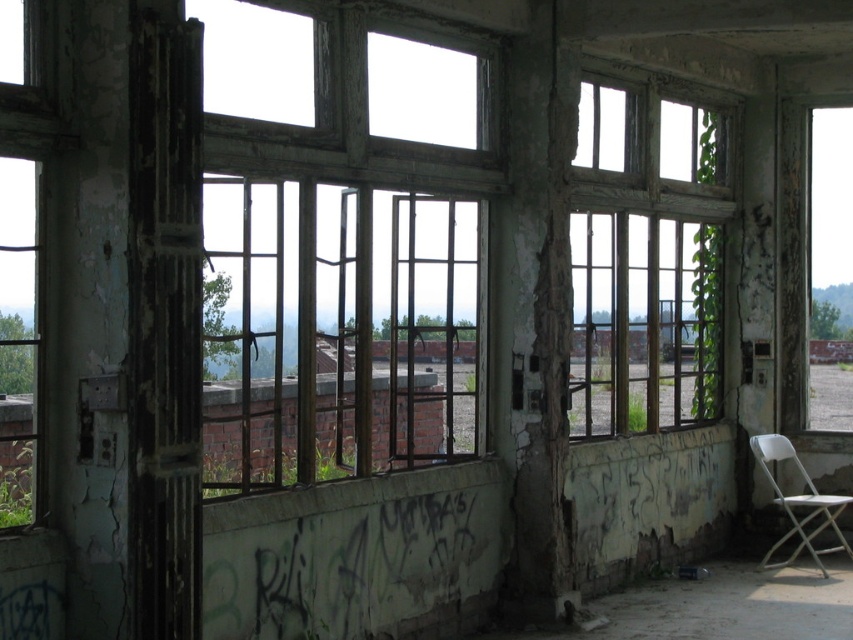
You are a maintenance worker needing to reach the wooden window at center from the white plastic folding chair at lower right. Can you comfortably step from the chair to the window without needing to move the chair?

The wooden window at center and white plastic folding chair at lower right are 1.64 meters apart from each other. Since the distance between them is 1.64 meters, which is a bit more than the average comfortable stepping distance for most people, it might be challenging to step comfortably without moving the chair.

You are a maintenance worker inspecting the building. You see the rusty metal window at right and the white plastic folding chair at lower right. Which object is closer to you from your current position?

The rusty metal window at right is closer to you because the white plastic folding chair at lower right is behind it, meaning the window is in front of the chair.

You are standing inside the abandoned building and want to sit down. There is a rusty metal window at right and a white plastic folding chair at lower right. Which object is taller, and can you sit on the chair?

The rusty metal window at right is taller than the white plastic folding chair at lower right. However, since the chair is designed for sitting, you can sit on the white plastic folding chair at lower right.